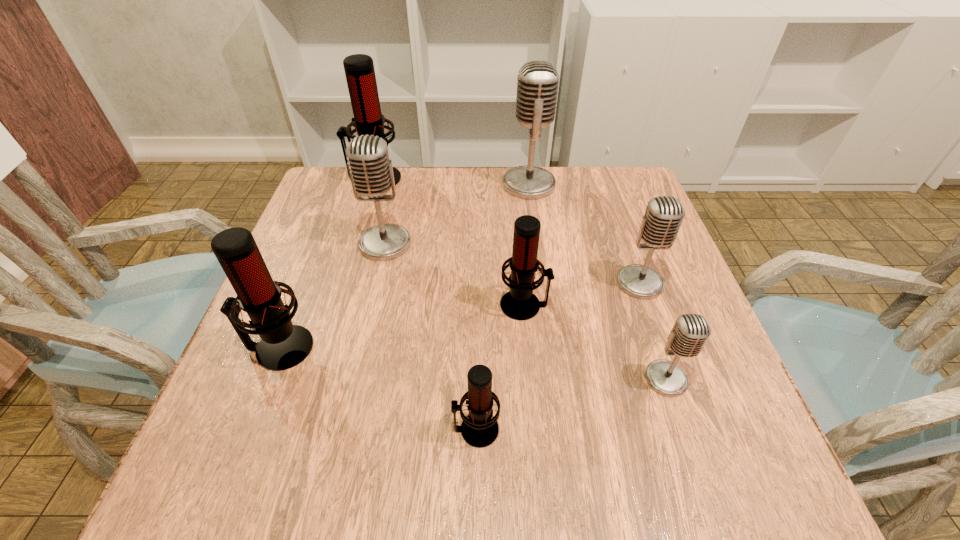
Where is `red microphone identified as the third closest to the third smallest red microphone`? red microphone identified as the third closest to the third smallest red microphone is located at coordinates (359, 70).

Find the location of `gray microphone that is the nearest to the third biggest red microphone`. gray microphone that is the nearest to the third biggest red microphone is located at coordinates (664, 214).

At what (x,y) coordinates should I click in order to perform the action: click on gray microphone that is the third closest to the fourth microphone from left to right. Please return your answer as a coordinate pair (x, y). Looking at the image, I should click on 371,173.

At what (x,y) coordinates should I click in order to perform the action: click on free spot that satisfies the following two spatial constraints: 1. on the back side of the biggest red microphone; 2. on the left side of the third farthest red microphone. Please return your answer as a coordinate pair (x, y). This screenshot has height=540, width=960. Looking at the image, I should click on (346, 178).

Image resolution: width=960 pixels, height=540 pixels. In order to click on vacant position in the image that satisfies the following two spatial constraints: 1. on the front side of the leftmost gray microphone; 2. on the left side of the smallest gray microphone in this screenshot , I will do `click(353, 379)`.